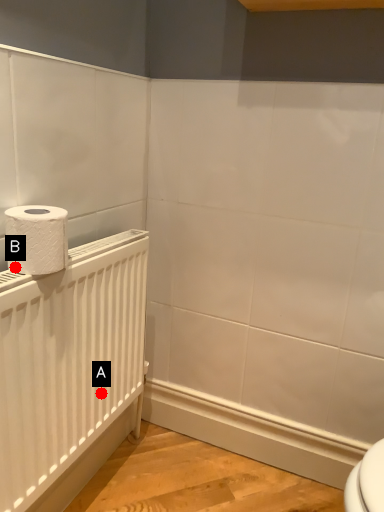
Question: Two points are circled on the image, labeled by A and B beside each circle. Which point is farther from the camera taking this photo?

Choices:
 (A) A is further
 (B) B is further

Answer: (A)